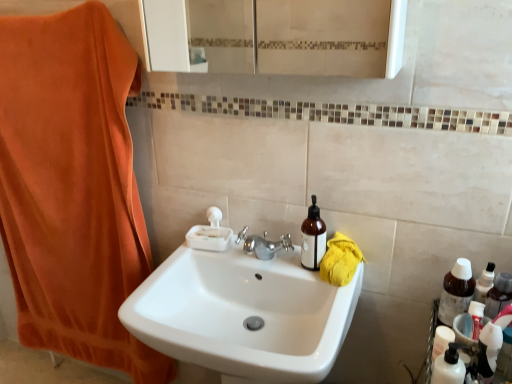
Question: Should I look upward or downward to see brown glass bottle at upper right, the first bottle from the left?

Choices:
 (A) down
 (B) up

Answer: (A)

Question: Should I look upward or downward to see yellow cotton towel at right?

Choices:
 (A) down
 (B) up

Answer: (A)

Question: Does brown glass bottle at right, placed as the 2th bottle when sorted from left to right, lie in front of translucent plastic toothpaste tube at lower right?

Choices:
 (A) yes
 (B) no

Answer: (B)

Question: Is brown glass bottle at right, placed as the 2th bottle when sorted from left to right, positioned beyond the bounds of translucent plastic toothpaste tube at lower right?

Choices:
 (A) no
 (B) yes

Answer: (B)

Question: From a real-world perspective, is brown glass bottle at right, placed as the 2th bottle when sorted from left to right, located higher than translucent plastic toothpaste tube at lower right?

Choices:
 (A) yes
 (B) no

Answer: (B)

Question: Considering the relative sizes of brown glass bottle at right, acting as the 1th bottle starting from the right, and translucent plastic toothpaste tube at lower right in the image provided, is brown glass bottle at right, acting as the 1th bottle starting from the right, smaller than translucent plastic toothpaste tube at lower right?

Choices:
 (A) yes
 (B) no

Answer: (B)

Question: From a real-world perspective, is brown glass bottle at right, acting as the 1th bottle starting from the right, positioned under translucent plastic toothpaste tube at lower right based on gravity?

Choices:
 (A) no
 (B) yes

Answer: (B)

Question: Can you confirm if brown glass bottle at right, acting as the 1th bottle starting from the right, is positioned to the right of translucent plastic toothpaste tube at lower right?

Choices:
 (A) no
 (B) yes

Answer: (B)

Question: From a real-world perspective, is yellow cotton towel at right located beneath white glossy sink at center?

Choices:
 (A) no
 (B) yes

Answer: (A)

Question: From the image's perspective, does yellow cotton towel at right appear higher than white glossy sink at center?

Choices:
 (A) yes
 (B) no

Answer: (A)

Question: Does yellow cotton towel at right have a greater width compared to white glossy sink at center?

Choices:
 (A) yes
 (B) no

Answer: (B)

Question: Is the position of yellow cotton towel at right less distant than that of white glossy sink at center?

Choices:
 (A) no
 (B) yes

Answer: (A)

Question: From the image's perspective, is yellow cotton towel at right located beneath white glossy sink at center?

Choices:
 (A) yes
 (B) no

Answer: (B)

Question: Can you confirm if yellow cotton towel at right is taller than white glossy sink at center?

Choices:
 (A) no
 (B) yes

Answer: (A)

Question: Considering the relative positions of yellow cotton towel at right and brown glass bottle at upper right, the first bottle from the left, in the image provided, is yellow cotton towel at right behind brown glass bottle at upper right, the first bottle from the left,?

Choices:
 (A) no
 (B) yes

Answer: (A)